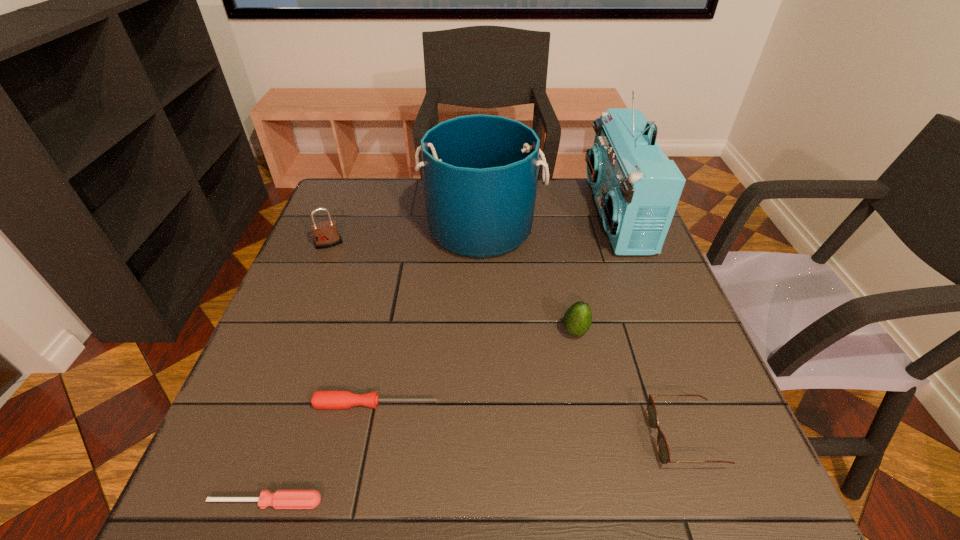
At what (x,y) coordinates should I click in order to perform the action: click on vacant region between the spectacles and the padlock. Please return your answer as a coordinate pair (x, y). The height and width of the screenshot is (540, 960). Looking at the image, I should click on (507, 341).

The width and height of the screenshot is (960, 540). Identify the location of object that can be found as the fourth closest to the spectacles. (480, 172).

The image size is (960, 540). In order to click on the fourth closest object relative to the bucket in this screenshot , I will do `click(335, 399)`.

You are a GUI agent. You are given a task and a screenshot of the screen. Output one action in this format:
    pyautogui.click(x=<x>, y=<y>)
    Task: Click on the blank space that satisfies the following two spatial constraints: 1. at the tip of the farther screwdriver; 2. on the front side of the nearest object
    The width and height of the screenshot is (960, 540).
    Given the screenshot: What is the action you would take?
    pyautogui.click(x=357, y=502)